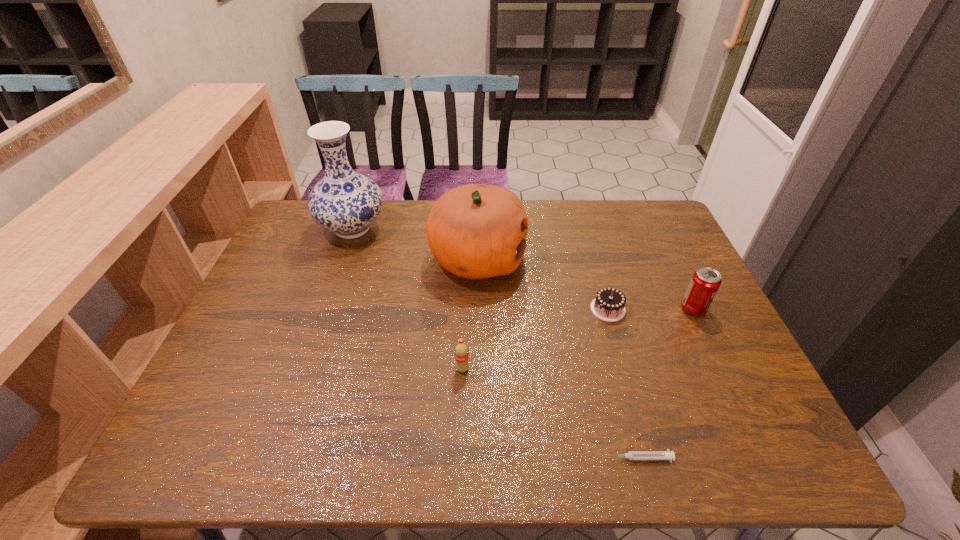
Locate an element on the screen. object that stands as the fourth closest to the chocolate cake is located at coordinates (461, 350).

Locate an element on the screen. The height and width of the screenshot is (540, 960). the closest object to the left soda is located at coordinates (476, 231).

Where is `free space that satisfies the following two spatial constraints: 1. on the back side of the right soda; 2. on the left side of the nearer soda`? This screenshot has width=960, height=540. free space that satisfies the following two spatial constraints: 1. on the back side of the right soda; 2. on the left side of the nearer soda is located at coordinates (465, 309).

Locate an element on the screen. This screenshot has height=540, width=960. free point that satisfies the following two spatial constraints: 1. on the front side of the chocolate cake; 2. on the right side of the leftmost object is located at coordinates (324, 309).

Locate an element on the screen. The height and width of the screenshot is (540, 960). free point that satisfies the following two spatial constraints: 1. on the front side of the chocolate cake; 2. at the needle end of the syringe is located at coordinates (651, 458).